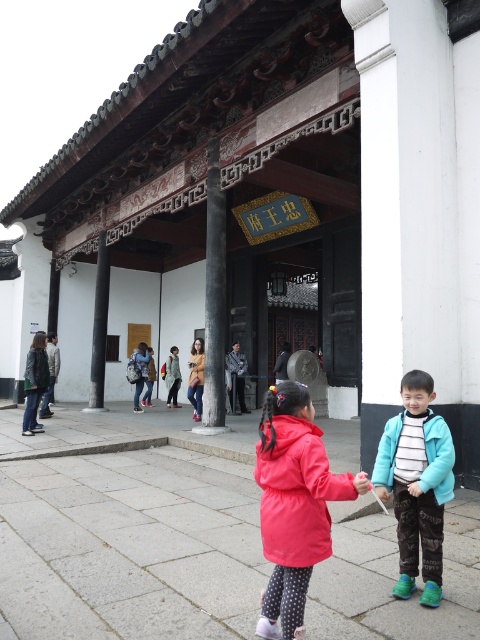
Is point (300, 451) positioned behind point (203, 372)?

That is False.

Which is above, matte pink coat at center or denim jacket at center?

matte pink coat at center is higher up.

You are a GUI agent. You are given a task and a screenshot of the screen. Output one action in this format:
    pyautogui.click(x=<x>, y=<y>)
    Task: Click on the matte pink coat at center
    The width and height of the screenshot is (480, 640).
    Given the screenshot: What is the action you would take?
    pyautogui.click(x=294, y=502)

You are a GUI agent. You are given a task and a screenshot of the screen. Output one action in this format:
    pyautogui.click(x=<x>, y=<y>)
    Task: Click on the matte pink coat at center
    
    Given the screenshot: What is the action you would take?
    pyautogui.click(x=294, y=502)

You are a GUI agent. You are given a task and a screenshot of the screen. Output one action in this format:
    pyautogui.click(x=<x>, y=<y>)
    Task: Click on the matte pink coat at center
    The image size is (480, 640).
    Given the screenshot: What is the action you would take?
    pyautogui.click(x=294, y=502)

Image resolution: width=480 pixels, height=640 pixels. What do you see at coordinates (294, 502) in the screenshot? I see `matte pink coat at center` at bounding box center [294, 502].

Is point (299, 401) positioned after point (429, 481)?

No, it is in front of (429, 481).

What are the coordinates of `matte pink coat at center` in the screenshot? It's located at (294, 502).

Which is more to the right, teal fleece jacket at center or denim jacket at center?

teal fleece jacket at center

The width and height of the screenshot is (480, 640). Find the location of `teal fleece jacket at center`. teal fleece jacket at center is located at coordinates (417, 483).